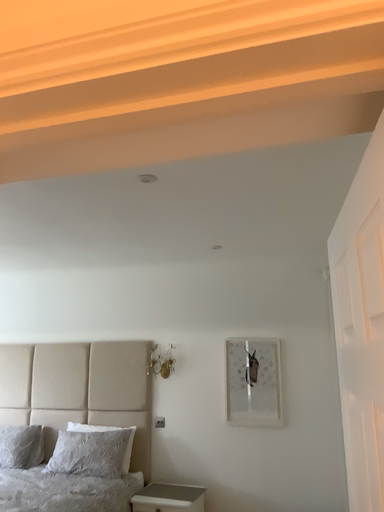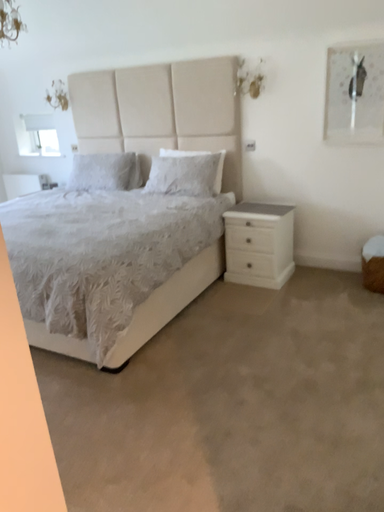
Question: How did the camera likely rotate when shooting the video?

Choices:
 (A) rotated upward
 (B) rotated downward

Answer: (B)